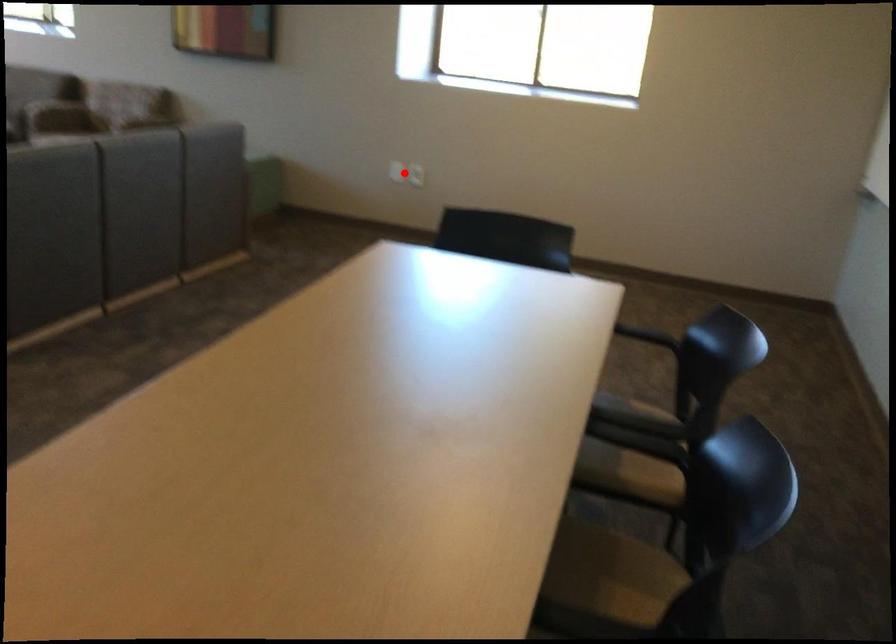
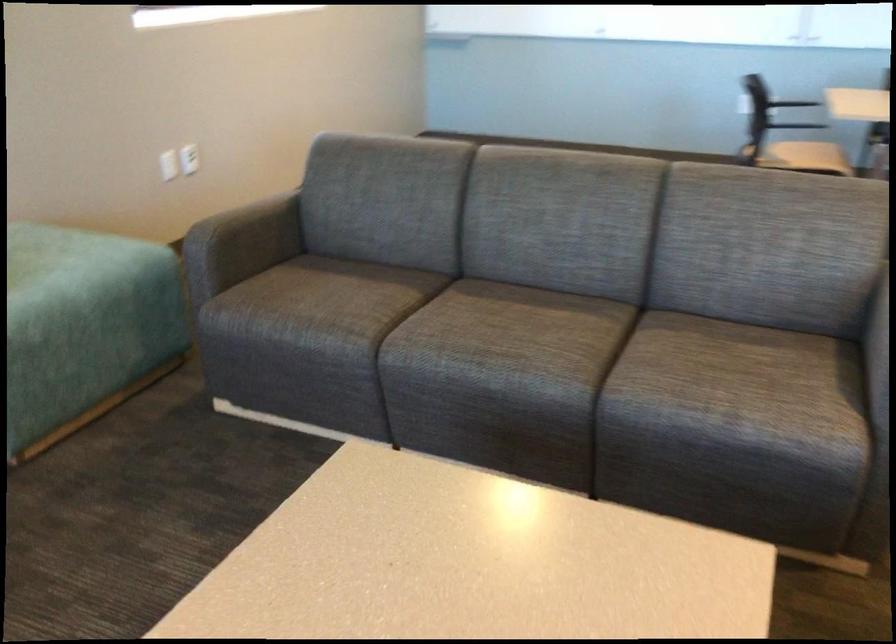
Question: I am providing you with two images of the same scene from different viewpoints. A red point is shown in image1. For the corresponding object point in image2, is it positioned nearer or farther from the camera?

Choices:
 (A) Nearer
 (B) Farther

Answer: (A)